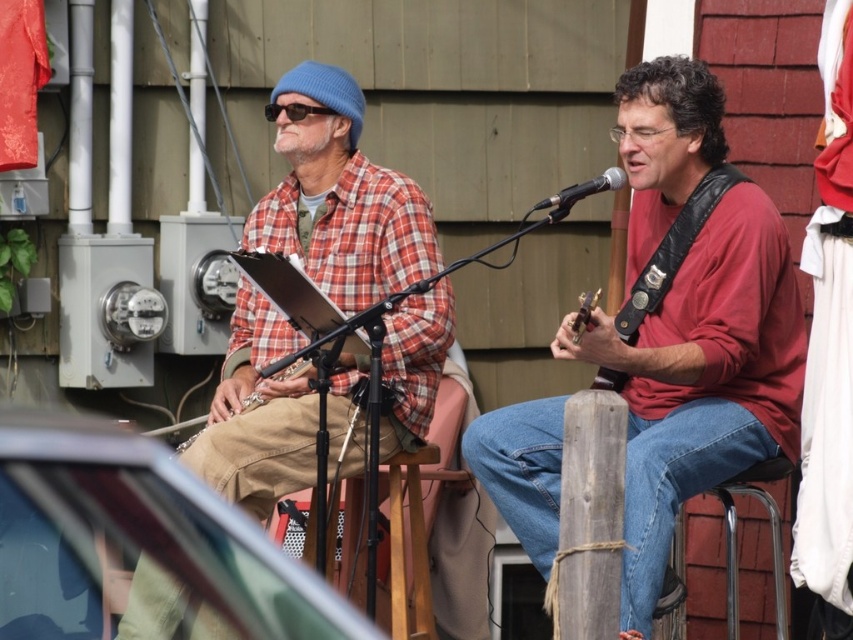
Does point (495, 412) lie behind point (604, 189)?

Yes.

Is point (525, 548) in front of point (558, 216)?

No, it is behind (558, 216).

Locate an element on the screen. This screenshot has height=640, width=853. matte red shirt at center is located at coordinates (701, 380).

What do you see at coordinates (701, 380) in the screenshot?
I see `matte red shirt at center` at bounding box center [701, 380].

Between matte red shirt at center and wooden acoustic guitar at center, which one is positioned lower?

matte red shirt at center

This screenshot has width=853, height=640. What do you see at coordinates (701, 380) in the screenshot?
I see `matte red shirt at center` at bounding box center [701, 380].

Find the location of a particular element. This screenshot has height=640, width=853. matte red shirt at center is located at coordinates (701, 380).

Is wooden stool at center thinner than black metallic microphone at center?

In fact, wooden stool at center might be wider than black metallic microphone at center.

Which is above, wooden stool at center or black metallic microphone at center?

black metallic microphone at center

Which is behind, point (358, 520) or point (593, 180)?

Point (358, 520)

Find the location of a particular element. wooden stool at center is located at coordinates (422, 502).